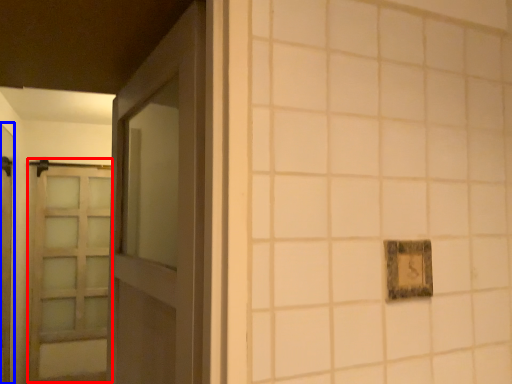
Question: Which of the following is the closest to the observer, barn door (highlighted by a red box) or elevator (highlighted by a blue box)?

Choices:
 (A) barn door
 (B) elevator

Answer: (B)